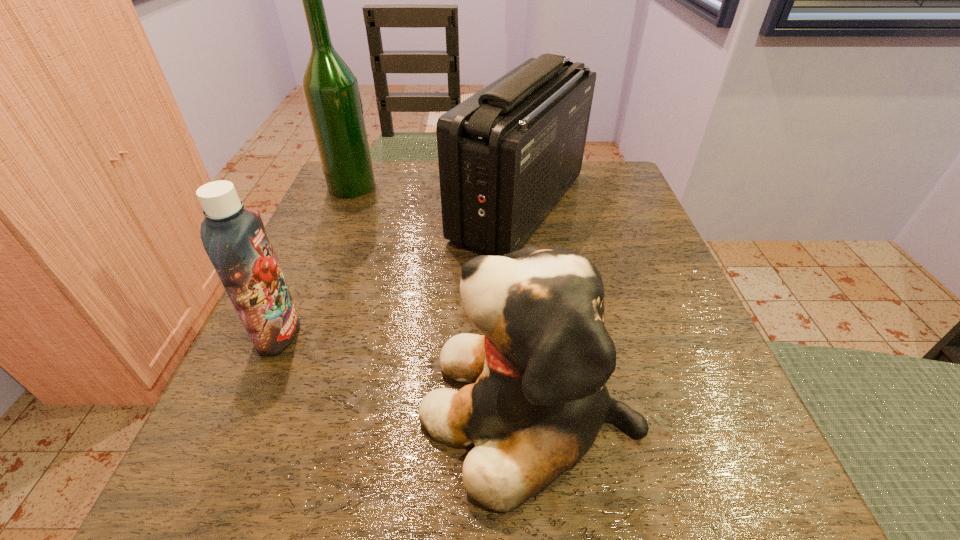
The height and width of the screenshot is (540, 960). Identify the location of object located at the far right corner. (507, 155).

Locate an element on the screen. object located in the near right corner section of the desktop is located at coordinates [538, 400].

I want to click on vacant region at the far edge of the desktop, so click(x=427, y=160).

This screenshot has width=960, height=540. I want to click on vacant area at the near edge of the desktop, so click(438, 457).

Identify the location of free space at the left edge. This screenshot has height=540, width=960. (361, 257).

Find the location of a particular element. vacant position at the right edge of the desktop is located at coordinates (680, 296).

Locate an element on the screen. This screenshot has width=960, height=540. free region at the far left corner of the desktop is located at coordinates (397, 161).

The image size is (960, 540). Identify the location of free point at the far right corner. (606, 176).

The width and height of the screenshot is (960, 540). Find the location of `vacant area that lies between the alcohol and the puppy`. vacant area that lies between the alcohol and the puppy is located at coordinates (441, 297).

The width and height of the screenshot is (960, 540). I want to click on free space between the radio receiver and the tallest object, so pyautogui.click(x=436, y=196).